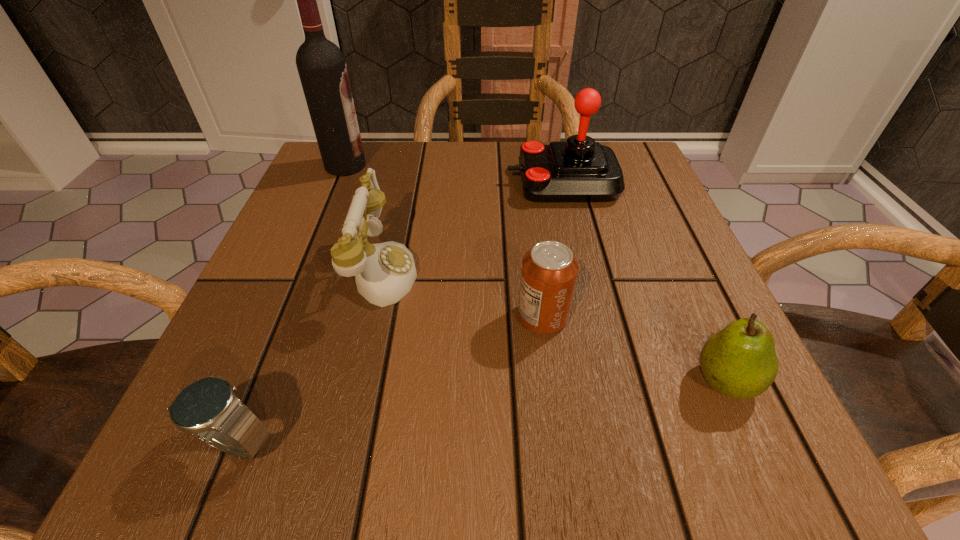
Where is `free space between the wine bottle and the joystick`? The height and width of the screenshot is (540, 960). free space between the wine bottle and the joystick is located at coordinates (454, 174).

Locate an element on the screen. This screenshot has width=960, height=540. free space that is in between the tallest object and the can is located at coordinates (444, 241).

The height and width of the screenshot is (540, 960). What are the coordinates of `blank region between the pear and the shortest object` in the screenshot? It's located at (481, 412).

Where is `free space between the joystick and the watch`? The height and width of the screenshot is (540, 960). free space between the joystick and the watch is located at coordinates (399, 313).

At what (x,y) coordinates should I click in order to perform the action: click on object that stands as the closest to the wine bottle. Please return your answer as a coordinate pair (x, y). The height and width of the screenshot is (540, 960). Looking at the image, I should click on (385, 272).

What are the coordinates of `the fifth closest object to the joystick` in the screenshot? It's located at (208, 408).

You are a GUI agent. You are given a task and a screenshot of the screen. Output one action in this format:
    pyautogui.click(x=<x>, y=<y>)
    Task: Click on the blank space that satisfies the following two spatial constraints: 1. on the base of the second nearest object; 2. on the right side of the second tallest object
    The image size is (960, 540).
    Given the screenshot: What is the action you would take?
    pyautogui.click(x=610, y=381)

You are a GUI agent. You are given a task and a screenshot of the screen. Output one action in this format:
    pyautogui.click(x=<x>, y=<y>)
    Task: Click on the free spot that satisfies the following two spatial constraints: 1. on the back side of the can; 2. on the label of the wine bottle
    
    Given the screenshot: What is the action you would take?
    pyautogui.click(x=523, y=166)

This screenshot has height=540, width=960. Find the location of `vacant space that satisfies the following two spatial constraints: 1. on the dial of the pear; 2. on the left side of the telephone`. vacant space that satisfies the following two spatial constraints: 1. on the dial of the pear; 2. on the left side of the telephone is located at coordinates (355, 381).

Where is `vacant region that satisfies the following two spatial constraints: 1. on the front side of the can; 2. on the right side of the second nearest object`? vacant region that satisfies the following two spatial constraints: 1. on the front side of the can; 2. on the right side of the second nearest object is located at coordinates (551, 381).